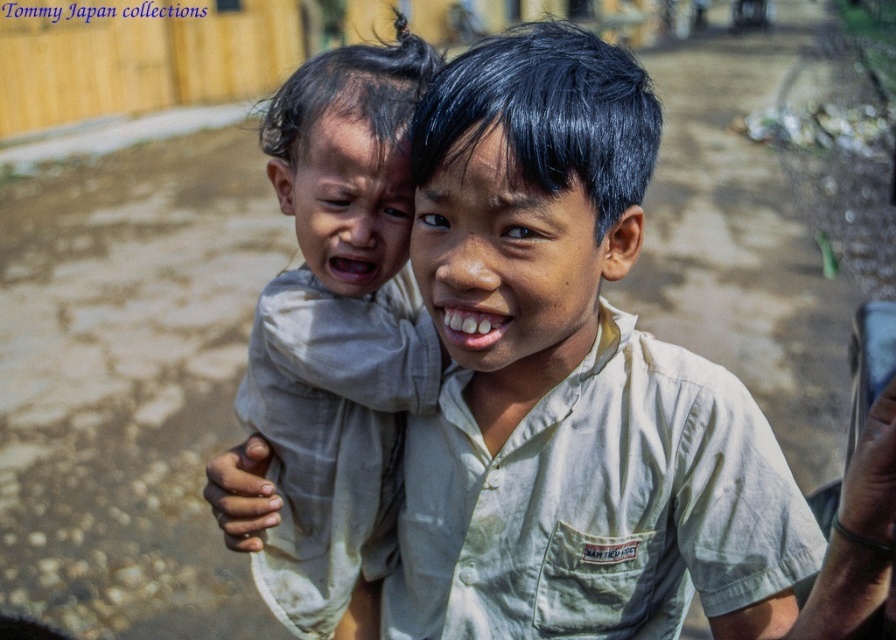
Question: Is light beige shirt at center positioned at the back of light beige fabric baby at left?

Choices:
 (A) no
 (B) yes

Answer: (A)

Question: Considering the relative positions of light beige shirt at center and light beige fabric baby at left in the image provided, where is light beige shirt at center located with respect to light beige fabric baby at left?

Choices:
 (A) above
 (B) below

Answer: (B)

Question: Is light beige shirt at center smaller than light beige fabric baby at left?

Choices:
 (A) no
 (B) yes

Answer: (B)

Question: Which point is closer to the camera?

Choices:
 (A) (470, 106)
 (B) (307, 124)

Answer: (A)